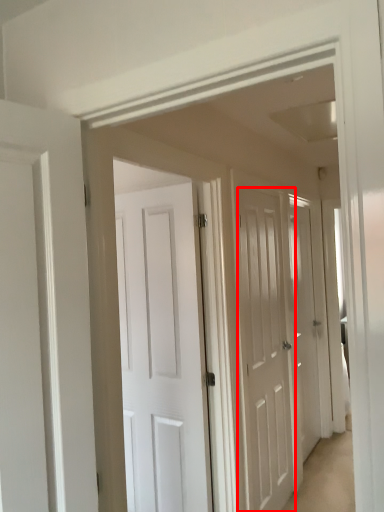
Question: In this image, where is door (annotated by the red box) located relative to door?

Choices:
 (A) right
 (B) left

Answer: (B)